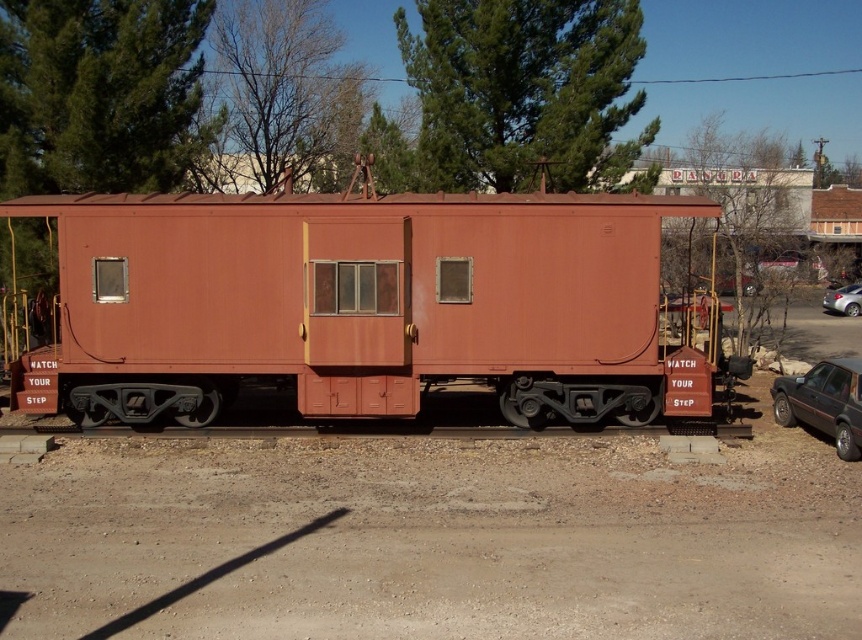
Between rusty metal caboose at center and silver metallic car at right, which one has less height?

silver metallic car at right is shorter.

Is the position of rusty metal caboose at center more distant than that of silver metallic car at right?

No, it is in front of silver metallic car at right.

What do you see at coordinates (367, 305) in the screenshot? I see `rusty metal caboose at center` at bounding box center [367, 305].

Where is `rusty metal caboose at center`? This screenshot has height=640, width=862. rusty metal caboose at center is located at coordinates (367, 305).

Who is positioned more to the right, rusty metal caboose at center or matte red caboose at center?

matte red caboose at center is more to the right.

Is rusty metal caboose at center above matte red caboose at center?

Yes, rusty metal caboose at center is above matte red caboose at center.

Where is `rusty metal caboose at center`? Image resolution: width=862 pixels, height=640 pixels. rusty metal caboose at center is located at coordinates (367, 305).

Does matte red caboose at center have a smaller size compared to silver metallic car at right?

Yes.

Does point (851, 406) come closer to viewer compared to point (853, 314)?

Yes, it is in front of point (853, 314).

Locate an element on the screen. Image resolution: width=862 pixels, height=640 pixels. matte red caboose at center is located at coordinates (823, 403).